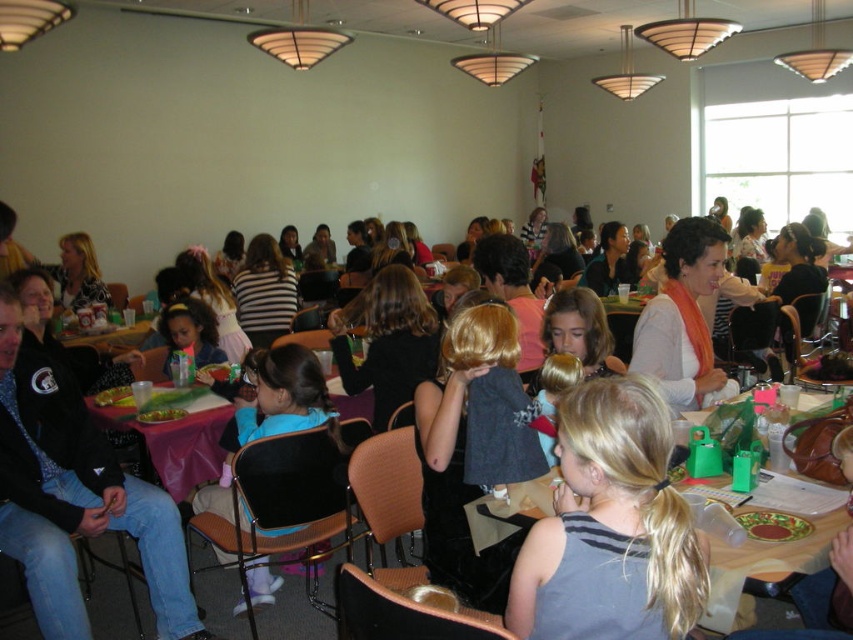
Question: Does matte plastic table at center appear on the left side of matte black jacket at center?

Choices:
 (A) yes
 (B) no

Answer: (B)

Question: Which point appears closest to the camera in this image?

Choices:
 (A) (158, 417)
 (B) (514, 598)
 (C) (10, 220)

Answer: (B)

Question: Does matte plastic cup at center appear on the left side of green leafy salad at center?

Choices:
 (A) yes
 (B) no

Answer: (A)

Question: Which object is positioned closest to the green leafy salad at center?

Choices:
 (A) matte plastic cup at center
 (B) matte plastic table at center
 (C) matte black jacket at center

Answer: (C)

Question: Is matte plastic cup at center to the right of green leafy salad at center from the viewer's perspective?

Choices:
 (A) no
 (B) yes

Answer: (A)

Question: Which object is closer to the camera taking this photo?

Choices:
 (A) matte plastic cup at center
 (B) matte black jacket at center

Answer: (B)